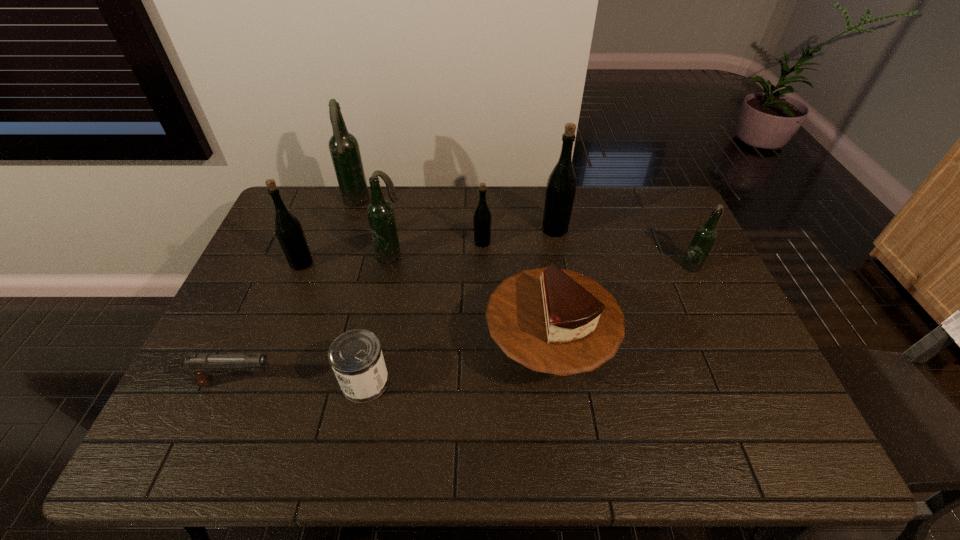
The height and width of the screenshot is (540, 960). I want to click on vacant position in the image that satisfies the following two spatial constraints: 1. on the back side of the can; 2. on the left side of the red cake, so click(x=372, y=346).